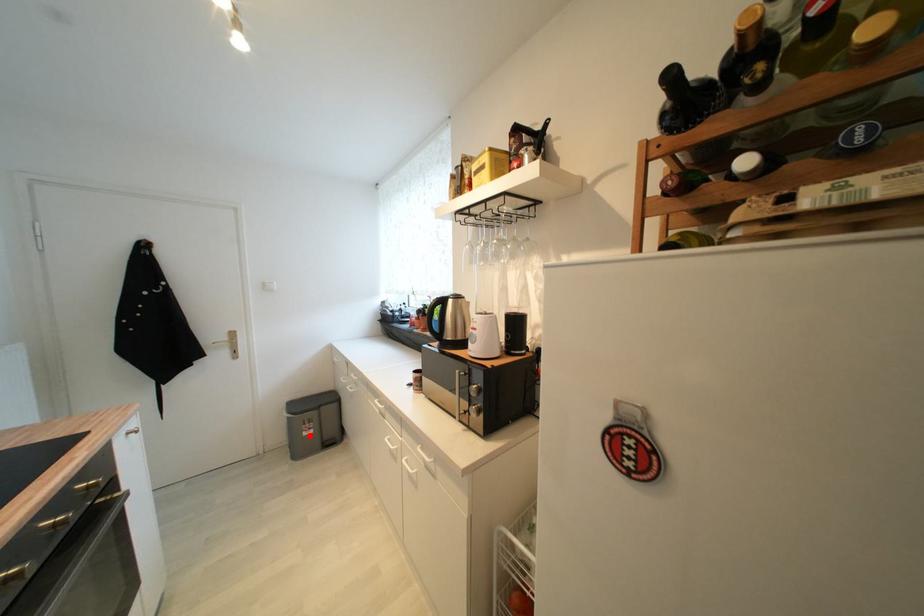
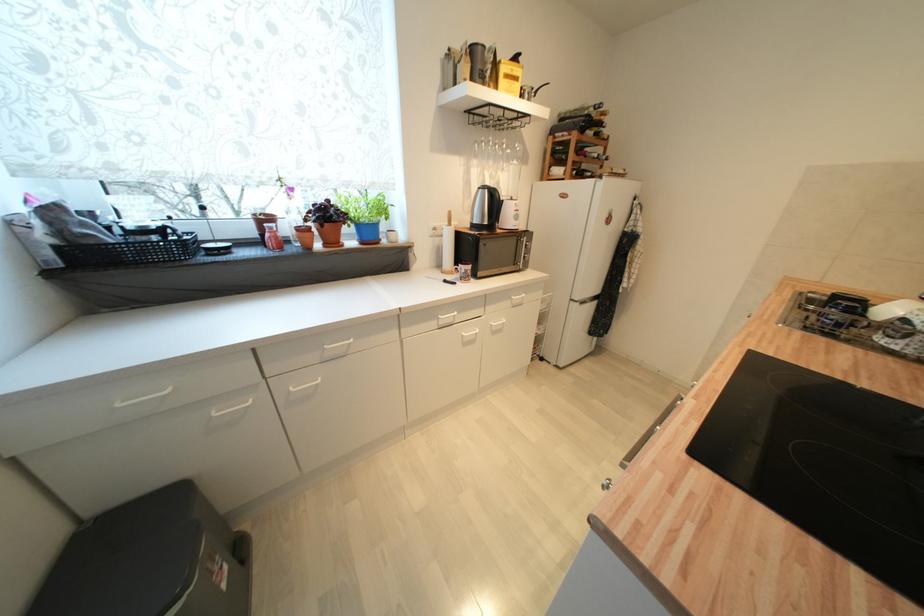
In the second image, find the point that corresponds to the highlighted location in the first image.

(228, 588)